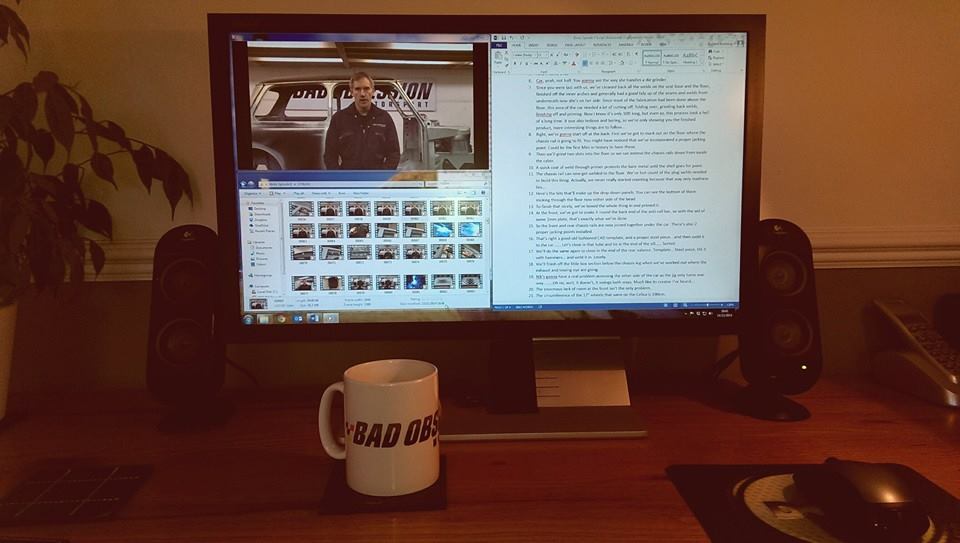
This screenshot has width=960, height=543. Find the location of `coffee cup`. coffee cup is located at coordinates (365, 391).